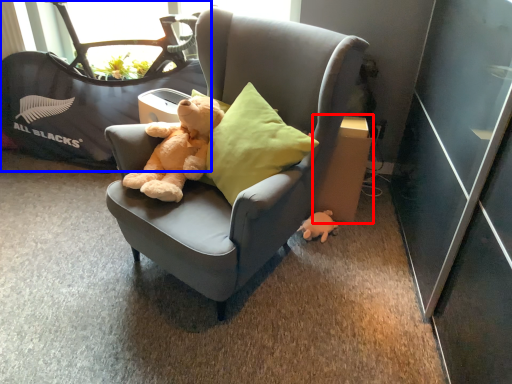
Question: Which object appears farthest to the camera in this image, cardboard box (highlighted by a red box) or baby carriage (highlighted by a blue box)?

Choices:
 (A) cardboard box
 (B) baby carriage

Answer: (B)